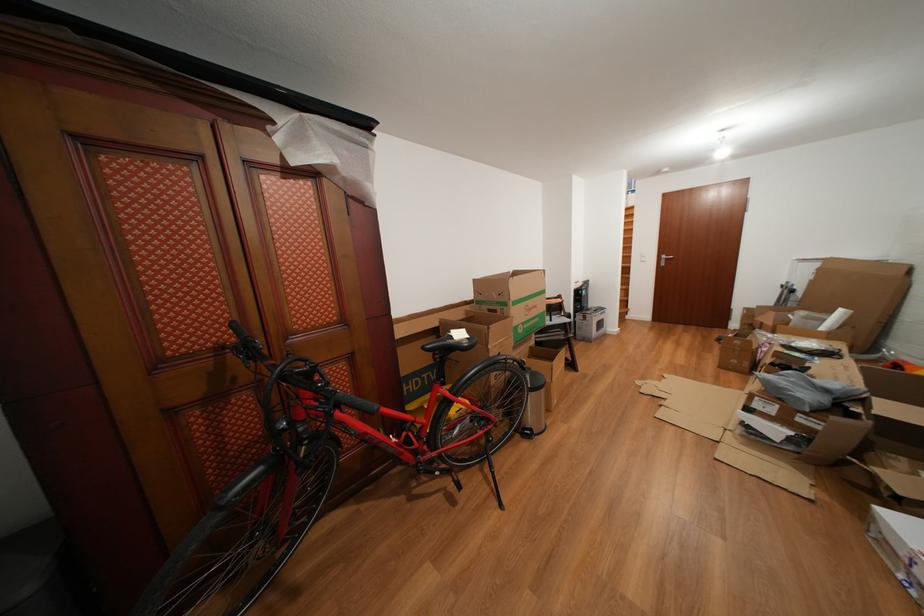
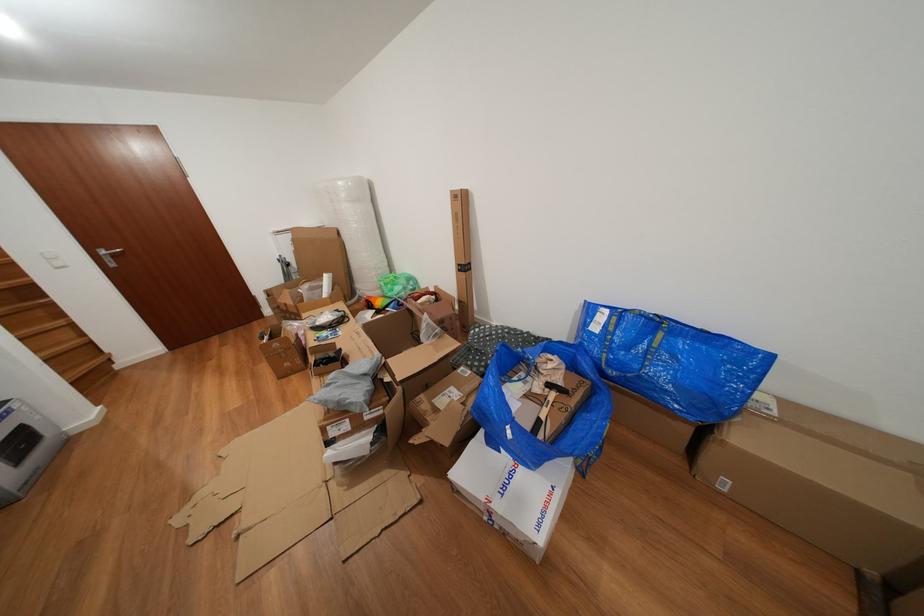
Find the pixel in the second image that matches (x=672, y=262) in the first image.

(112, 257)